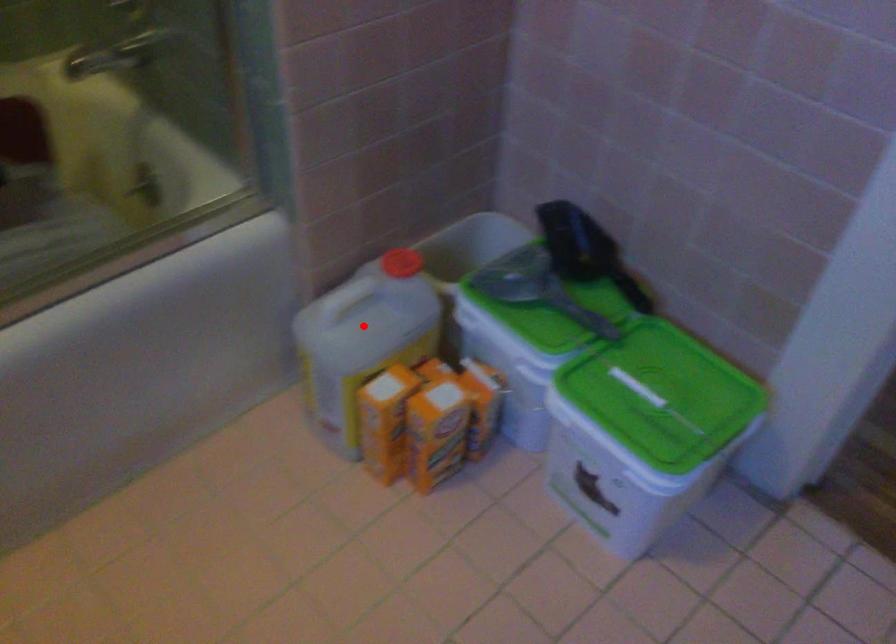
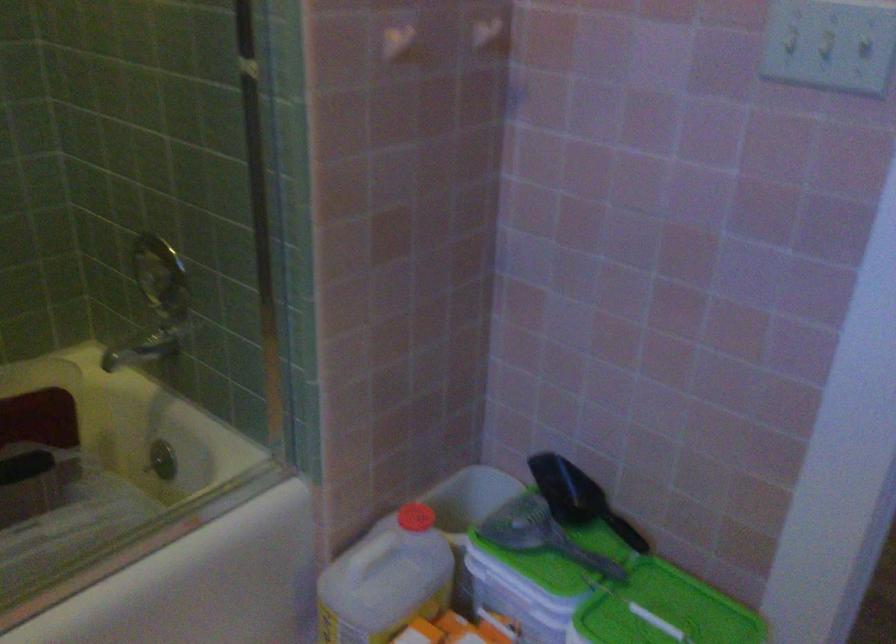
Find the pixel in the second image that matches the highlighted location in the first image.

(385, 581)